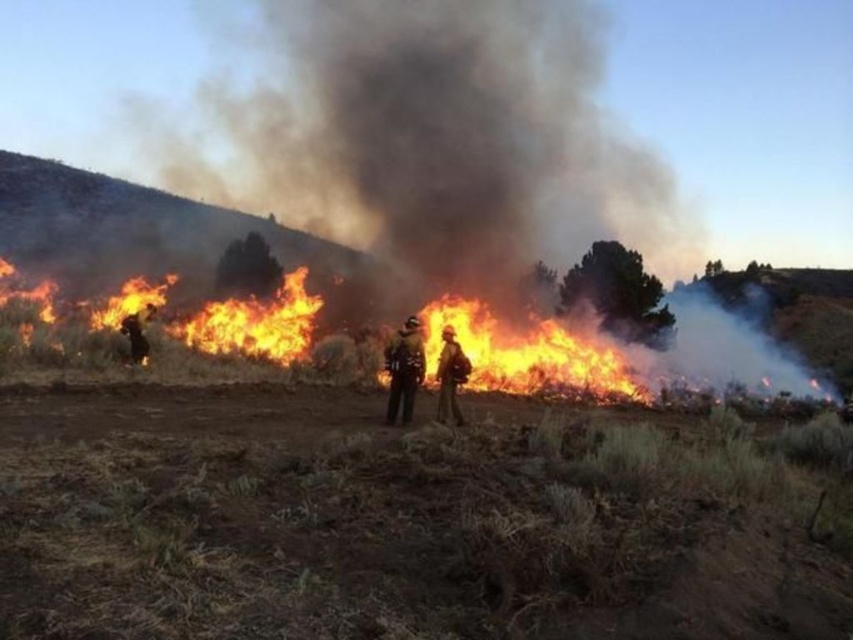
You are a firefighter in a reflective jacket needing to reach a water source 15 meters away from the orange flame helmet at center. If you start from the dark brown uniform at left, will you have to walk more than 15 meters to get there?

The distance between the orange flame helmet at center and dark brown uniform at left is 10.10 meters. Since the water source is 15 meters away from the orange flame helmet at center, starting from the dark brown uniform at left would require walking 10.10 meters plus the distance from the helmet to the water source. However, without knowing the exact direction, we can only estimate that it would be approximately 25.1 meters, which is more than 15 meters. Therefore, yes, you would have to walk more than 15m

You are a firefighter trying to reach the orange flame helmet at center to retrieve your equipment. The fire is spreading rapidly. Can you safely approach the helmet if you can move up to 15 meters in this situation?

The orange flame helmet at center is 14.91 meters away from the camera, so yes, you can safely approach it since the distance is within your 15 meters limit.

You are a firefighter standing at the edge of the wildfire scene. You need to reach a critical point marked at coordinates point (668,275) to set up a firebreak. Given your equipment, you can carry supplies up to 120 meters. Do you have enough capacity to reach that point without needing to resupply?

The point (668,275) is 116.29 meters away from the viewer. Since your equipment allows carrying supplies up to 120 meters, you have enough capacity to reach the point without needing to resupply.